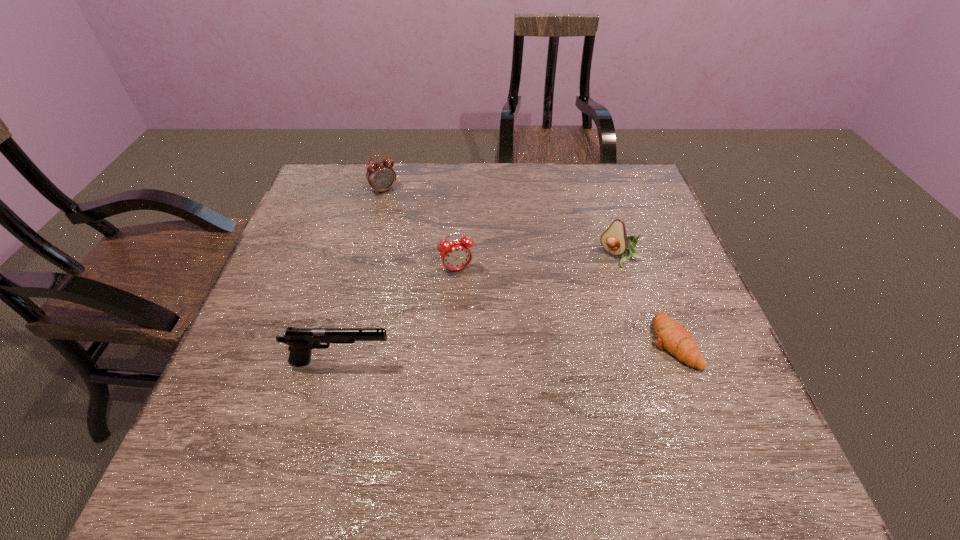
Find the location of `vacant region that satisfies the following two spatial constraints: 1. on the front side of the crescent roll; 2. on the right side of the avocado`. vacant region that satisfies the following two spatial constraints: 1. on the front side of the crescent roll; 2. on the right side of the avocado is located at coordinates pos(648,342).

Image resolution: width=960 pixels, height=540 pixels. Identify the location of free location that satisfies the following two spatial constraints: 1. on the back side of the third object from left to right; 2. on the right side of the avocado. (458, 257).

Identify the location of vacant space that satisfies the following two spatial constraints: 1. on the back side of the avocado; 2. on the right side of the third object from right to left. The image size is (960, 540). (458, 257).